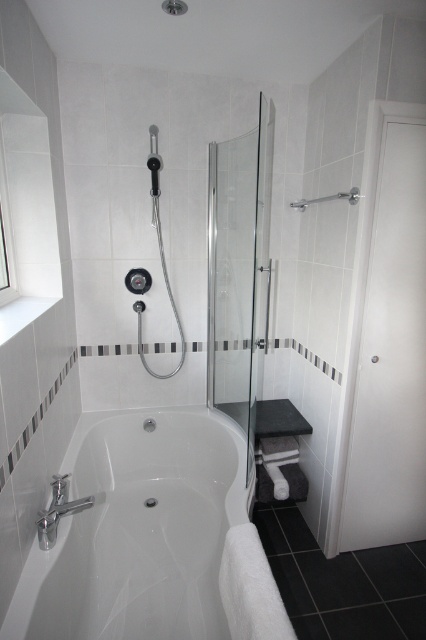
You are a contractor measuring the bathroom for new fixtures. You need to install a new shower door that must be shorter than the existing silver metallic towel bar at upper right. Based on the image, is the current transparent glass shower door at center an appropriate size for the new one?

The transparent glass shower door at center is taller than the silver metallic towel bar at upper right. Since the new shower door needs to be shorter than the towel bar, the current transparent glass shower door at center is too tall and would not be appropriate for the new installation.

You are standing in the bathroom and want to reach both points. Which point, point (149, 586) or point (370, 292), is closer to you?

Point (149, 586) is closer to the viewer than point (370, 292).